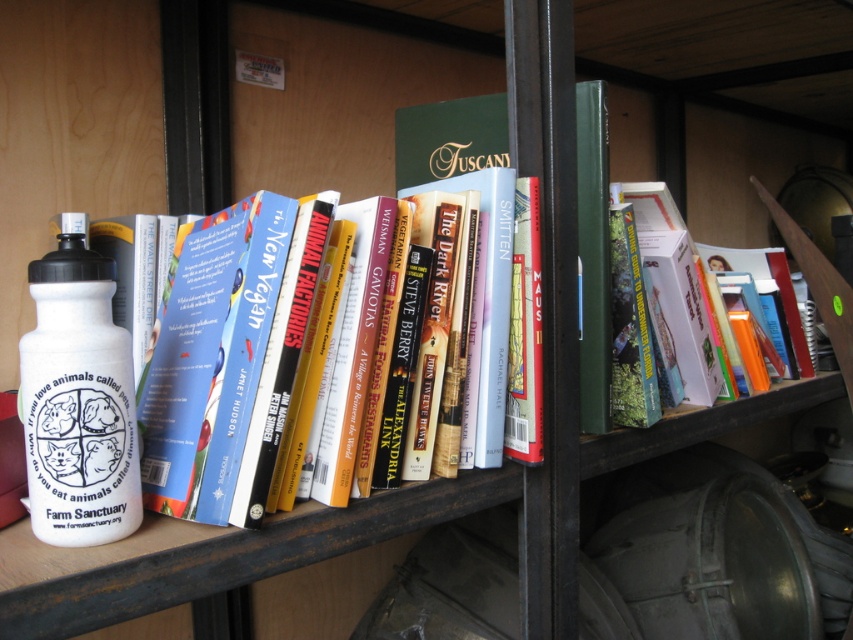
Question: Which of the following is the closest to the observer?

Choices:
 (A) (509, 333)
 (B) (602, 211)
 (C) (100, 323)

Answer: (C)

Question: From the image, what is the correct spatial relationship of white matte water bottle at left in relation to green hardcover book at center?

Choices:
 (A) below
 (B) above

Answer: (A)

Question: Which of these objects is positioned closest to the white matte water bottle at left?

Choices:
 (A) hardcover book at center
 (B) green hardcover book at center

Answer: (A)

Question: Which of the following is the closest to the observer?

Choices:
 (A) (65, 365)
 (B) (517, 282)

Answer: (A)

Question: Is green hardcover book at center further to the viewer compared to hardcover book at center?

Choices:
 (A) yes
 (B) no

Answer: (A)

Question: Does white matte water bottle at left have a smaller size compared to green hardcover book at center?

Choices:
 (A) no
 (B) yes

Answer: (A)